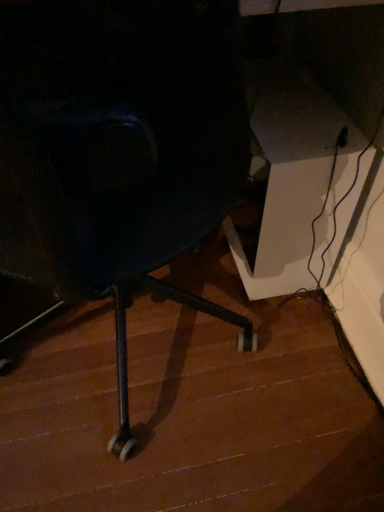
Image resolution: width=384 pixels, height=512 pixels. What do you see at coordinates (189, 413) in the screenshot? I see `matte black chair at center` at bounding box center [189, 413].

The width and height of the screenshot is (384, 512). Identify the location of matte black chair at center. (189, 413).

In order to face white glossy table at right, should I rotate leftwards or rightwards?

A 10.346 degree turn to the right will do.

Based on the photo, what is the approximate height of white glossy table at right?

17.37 inches.

This screenshot has height=512, width=384. In order to click on white glossy table at right in this screenshot , I will do `click(293, 181)`.

Describe the element at coordinates (293, 181) in the screenshot. The width and height of the screenshot is (384, 512). I see `white glossy table at right` at that location.

Find the location of a particular element. This screenshot has width=384, height=512. matte black chair at center is located at coordinates click(x=189, y=413).

Can you confirm if white glossy table at right is positioned to the left of matte black chair at center?

No, white glossy table at right is not to the left of matte black chair at center.

Does white glossy table at right come in front of matte black chair at center?

No, the depth of white glossy table at right is greater than that of matte black chair at center.

Is point (351, 212) positioned in front of point (298, 388)?

Yes.

From the image's perspective, which one is positioned higher, white glossy table at right or matte black chair at center?

white glossy table at right, from the image's perspective.

From the picture: From a real-world perspective, is white glossy table at right on top of matte black chair at center?

Yes, from a real-world perspective, white glossy table at right is above matte black chair at center.

Looking at their sizes, would you say white glossy table at right is wider or thinner than matte black chair at center?

white glossy table at right is thinner than matte black chair at center.

Considering the sizes of white glossy table at right and matte black chair at center in the image, is white glossy table at right taller or shorter than matte black chair at center?

white glossy table at right is taller than matte black chair at center.

Can you confirm if white glossy table at right is bigger than matte black chair at center?

Yes, white glossy table at right is bigger than matte black chair at center.

Which is correct: white glossy table at right is inside matte black chair at center, or outside of it?

white glossy table at right lies outside matte black chair at center.

Is white glossy table at right next to matte black chair at center and touching it?

No, white glossy table at right is not next to matte black chair at center.

Is white glossy table at right facing towards matte black chair at center?

No.

Looking at this image, how many degrees apart are the facing directions of white glossy table at right and matte black chair at center?

The angular difference between white glossy table at right and matte black chair at center is 0.332 degrees.

How far apart are white glossy table at right and matte black chair at center?

white glossy table at right and matte black chair at center are 14.34 inches apart.

Identify the location of stair in front of the white glossy table at right. (189, 413).

Considering the positions of objects matte black chair at center and white glossy table at right in the image provided, who is more to the right, matte black chair at center or white glossy table at right?

white glossy table at right is more to the right.

Does matte black chair at center come behind white glossy table at right?

No.

Is point (232, 401) closer to camera compared to point (316, 87)?

Yes, point (232, 401) is in front of point (316, 87).

From the image's perspective, which is above, matte black chair at center or white glossy table at right?

white glossy table at right is shown above in the image.

From a real-world perspective, which object rests below the other?

matte black chair at center, from a real-world perspective.

Which of these two, matte black chair at center or white glossy table at right, is thinner?

With smaller width is white glossy table at right.

Between matte black chair at center and white glossy table at right, which one has more height?

With more height is white glossy table at right.

Does matte black chair at center have a smaller size compared to white glossy table at right?

Yes, matte black chair at center is smaller than white glossy table at right.

From the picture: Is matte black chair at center spatially inside white glossy table at right, or outside of it?

The correct answer is: outside.

Is matte black chair at center with white glossy table at right?

No, matte black chair at center is not touching white glossy table at right.

Is matte black chair at center looking in the opposite direction of white glossy table at right?

That's not correct — matte black chair at center is not looking away from white glossy table at right.

How distant is matte black chair at center from white glossy table at right?

matte black chair at center and white glossy table at right are 36.42 centimeters apart.

Identify the location of table above the matte black chair at center (from a real-world perspective). (293, 181).

What are the coordinates of `stair below the white glossy table at right (from a real-world perspective)` in the screenshot? It's located at (189, 413).

Where is `table that is above the matte black chair at center (from a real-world perspective)`? This screenshot has height=512, width=384. table that is above the matte black chair at center (from a real-world perspective) is located at coordinates [293, 181].